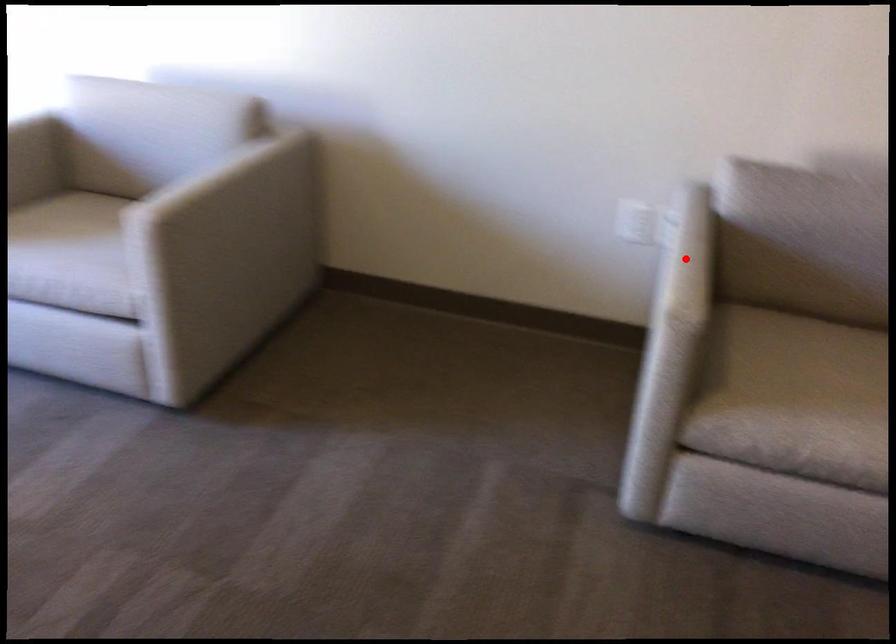
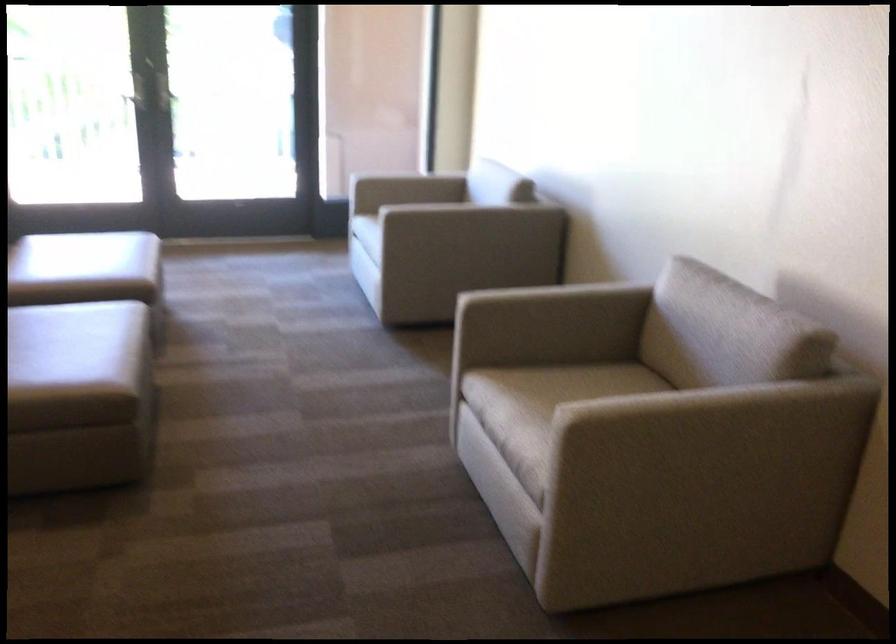
Question: I am providing you with two images of the same scene from different viewpoints. Given a red point in image1, look at the same physical point in image2. Is it:

Choices:
 (A) Closer to the viewpoint
 (B) Farther from the viewpoint

Answer: (B)